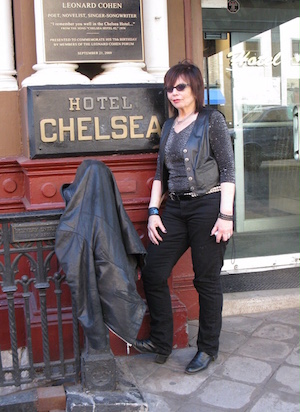
This screenshot has height=412, width=300. In order to click on door in this screenshot , I will do `click(269, 136)`.